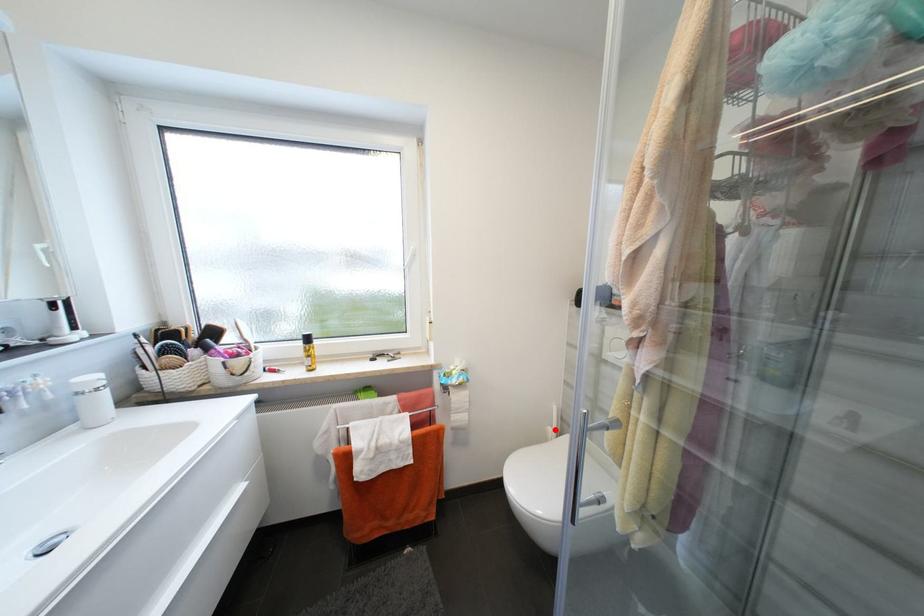
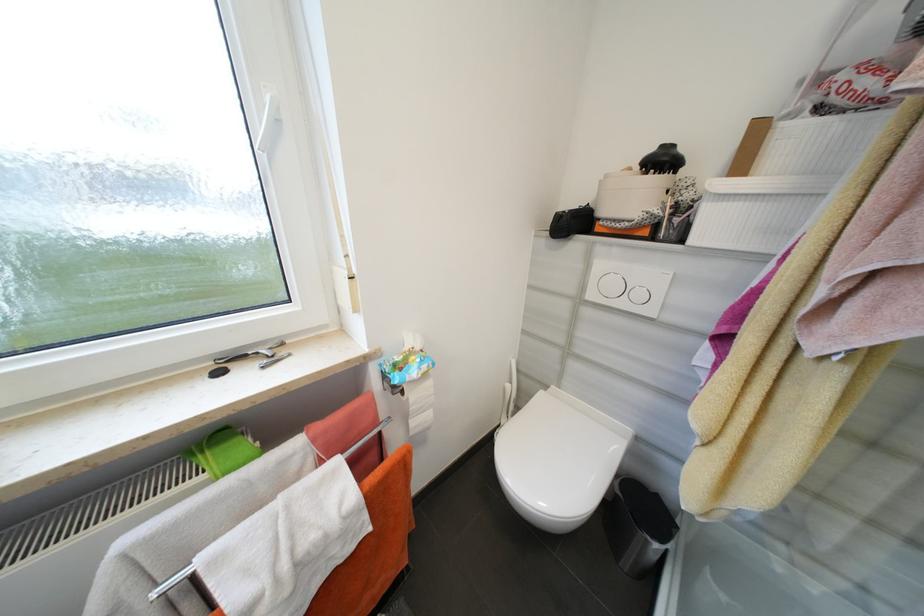
In the second image, find the point that corresponds to the highlighted location in the first image.

(514, 387)